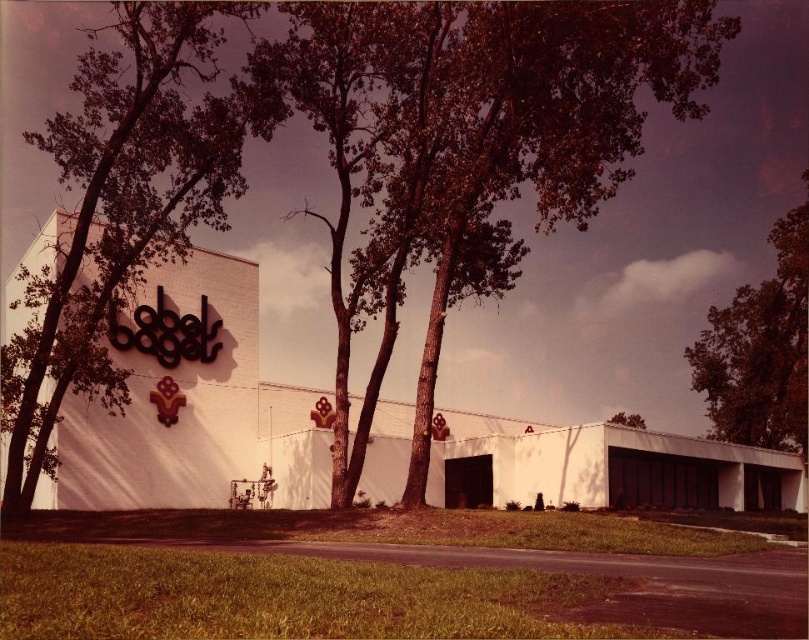
Question: Does green leafy tree at upper right have a lesser width compared to green leafy tree at upper center?

Choices:
 (A) no
 (B) yes

Answer: (A)

Question: Which of the following is the farthest from the observer?

Choices:
 (A) green leafy tree at upper center
 (B) green leafy tree at upper left
 (C) green leafy tree at upper right

Answer: (C)

Question: Which point is farther to the camera?

Choices:
 (A) green leafy tree at upper center
 (B) green leafy tree at upper left

Answer: (A)

Question: Which object is closer to the camera taking this photo?

Choices:
 (A) green leafy tree at upper left
 (B) green leafy tree at upper right
 (C) green leafy tree at upper center

Answer: (A)

Question: Is green leafy tree at upper left positioned at the back of green leafy tree at upper right?

Choices:
 (A) no
 (B) yes

Answer: (A)

Question: Is green leafy tree at upper left further to the viewer compared to green leafy tree at upper center?

Choices:
 (A) no
 (B) yes

Answer: (A)